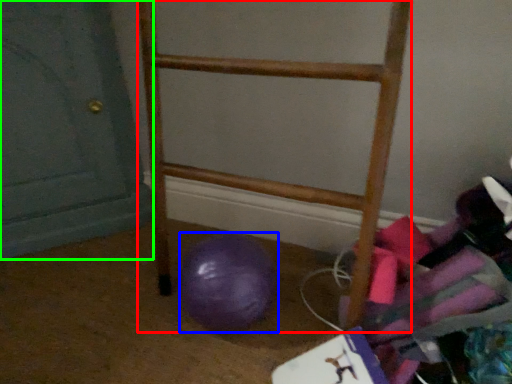
Question: Which is farther away from furniture (highlighted by a red box)? ball (highlighted by a blue box) or door (highlighted by a green box)?

Choices:
 (A) ball
 (B) door

Answer: (B)